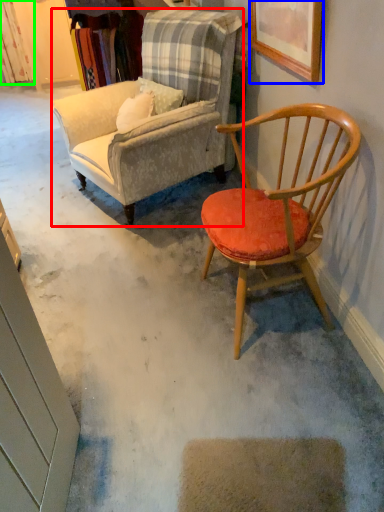
Question: Estimate the real-world distances between objects in this image. Which object is farther from chair (highlighted by a red box), picture frame (highlighted by a blue box) or curtain (highlighted by a green box)?

Choices:
 (A) picture frame
 (B) curtain

Answer: (B)